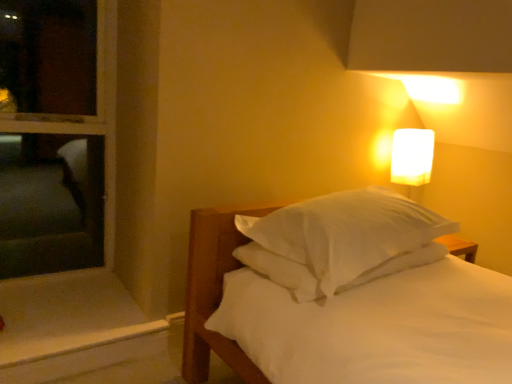
Question: From the image's perspective, relative to white wood window sill at lower left, is white frosted glass at upper right above or below?

Choices:
 (A) above
 (B) below

Answer: (A)

Question: Based on their positions, is white frosted glass at upper right located to the left or right of white wood window sill at lower left?

Choices:
 (A) right
 (B) left

Answer: (A)

Question: Which is nearer to the white wood window sill at lower left?

Choices:
 (A) white soft bed at center
 (B) white frosted glass at upper right

Answer: (A)

Question: Based on their relative distances, which object is nearer to the white soft bed at center?

Choices:
 (A) white wood window sill at lower left
 (B) white frosted glass at upper right

Answer: (A)